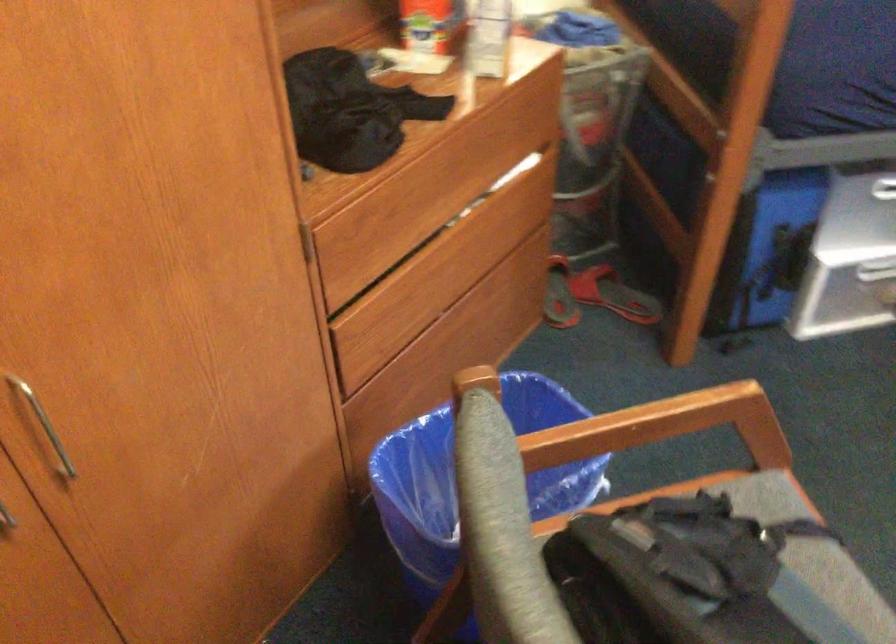
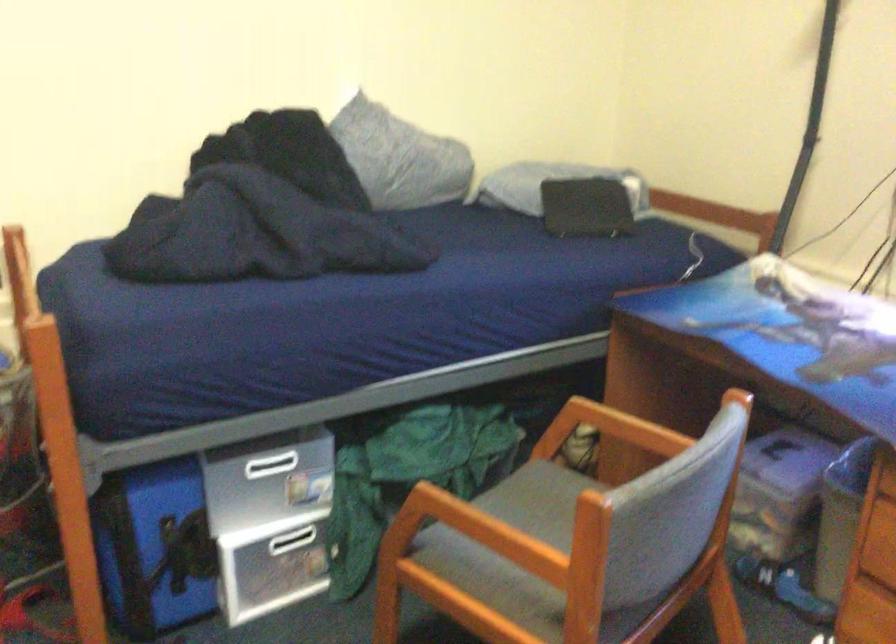
How did the camera likely rotate?

The rotation direction of the camera is right-up.